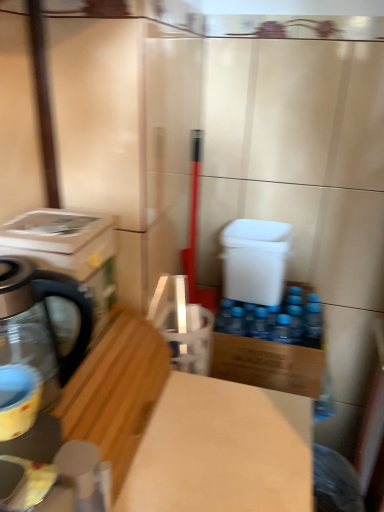
Question: Is white plastic water cooler at center not close to wooden cutting board at lower left?

Choices:
 (A) yes
 (B) no

Answer: (B)

Question: From the image's perspective, does white plastic water cooler at center appear higher than wooden cutting board at lower left?

Choices:
 (A) yes
 (B) no

Answer: (A)

Question: Is white plastic water cooler at center facing towards wooden cutting board at lower left?

Choices:
 (A) yes
 (B) no

Answer: (A)

Question: Considering the relative sizes of white plastic water cooler at center and wooden cutting board at lower left in the image provided, is white plastic water cooler at center wider than wooden cutting board at lower left?

Choices:
 (A) no
 (B) yes

Answer: (A)

Question: Considering the relative sizes of white plastic water cooler at center and wooden cutting board at lower left in the image provided, is white plastic water cooler at center smaller than wooden cutting board at lower left?

Choices:
 (A) yes
 (B) no

Answer: (A)

Question: Considering the positions of white glossy washing machine at left and matte yellow cup at left in the image, is white glossy washing machine at left bigger or smaller than matte yellow cup at left?

Choices:
 (A) small
 (B) big

Answer: (B)

Question: Is point (52, 243) closer or farther from the camera than point (18, 425)?

Choices:
 (A) farther
 (B) closer

Answer: (A)

Question: In terms of height, does white glossy washing machine at left look taller or shorter compared to matte yellow cup at left?

Choices:
 (A) short
 (B) tall

Answer: (B)

Question: Is white glossy washing machine at left to the left or to the right of matte yellow cup at left in the image?

Choices:
 (A) left
 (B) right

Answer: (A)

Question: From a real-world perspective, is wooden cutting board at lower left positioned above or below white plastic water cooler at center?

Choices:
 (A) above
 (B) below

Answer: (B)

Question: Is wooden cutting board at lower left situated inside white plastic water cooler at center or outside?

Choices:
 (A) inside
 (B) outside

Answer: (B)

Question: Looking at their shapes, would you say wooden cutting board at lower left is wider or thinner than white plastic water cooler at center?

Choices:
 (A) thin
 (B) wide

Answer: (B)

Question: Considering the positions of point [x=97, y=397] and point [x=276, y=229], is point [x=97, y=397] closer or farther from the camera than point [x=276, y=229]?

Choices:
 (A) farther
 (B) closer

Answer: (B)

Question: Is white glossy washing machine at left wider or thinner than white plastic water cooler at center?

Choices:
 (A) thin
 (B) wide

Answer: (A)

Question: Would you say white glossy washing machine at left is to the left or to the right of white plastic water cooler at center in the picture?

Choices:
 (A) left
 (B) right

Answer: (A)